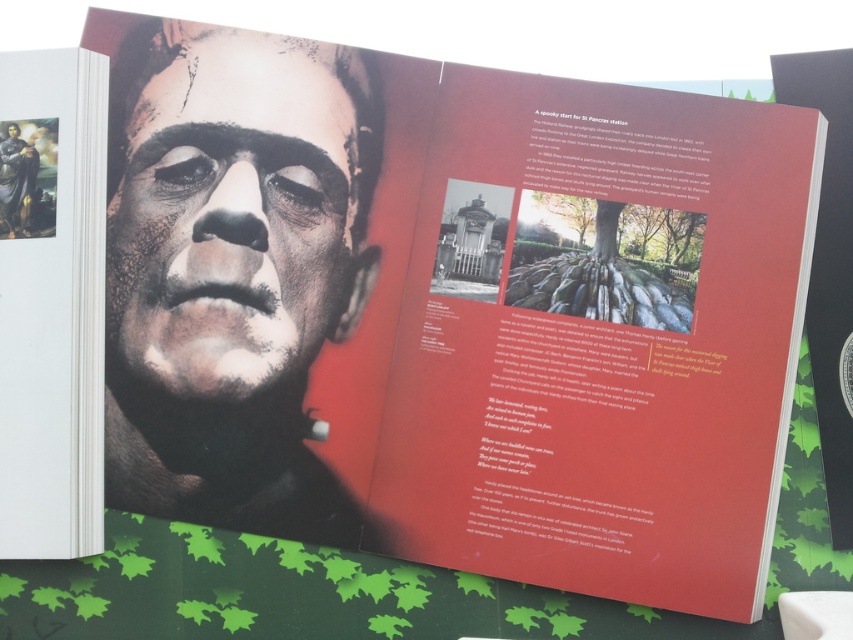
Does smooth matte face at center appear on the left side of smooth black statue at upper left?

Incorrect, smooth matte face at center is not on the left side of smooth black statue at upper left.

Can you confirm if smooth matte face at center is thinner than smooth black statue at upper left?

Incorrect, smooth matte face at center's width is not less than smooth black statue at upper left's.

Does point (253, 522) come closer to viewer compared to point (15, 141)?

Yes, point (253, 522) is in front of point (15, 141).

Locate an element on the screen. Image resolution: width=853 pixels, height=640 pixels. smooth matte face at center is located at coordinates (231, 269).